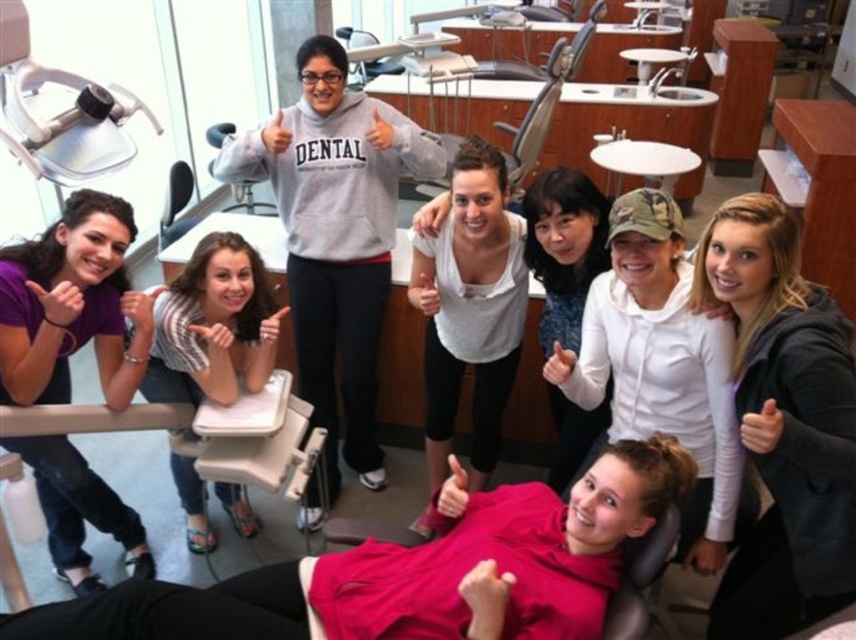
You are standing at the point labeled point (770, 448) in the dental clinic. You want to move to the exit located at point (507, 586). Is the exit directly in front of you or behind you?

The exit at point (507, 586) is behind the point (770, 448), so the exit is behind you.

You are standing at the point with coordinates (x=247, y=198) in the dental clinic. What object is exactly at your current location?

The gray fabric chair at center is exactly at the point with coordinates (x=247, y=198).

You are standing in the dental clinic and want to place a small potted plant exactly at point (468,577). If the plant is 1.6 meters tall, will it block the view of the dental chairs in the back row?

The point (468,577) is 1.56 meters away from the viewer. Since the plant is 1.6 meters tall, it may block the view of the dental chairs in the back row if placed at that point.